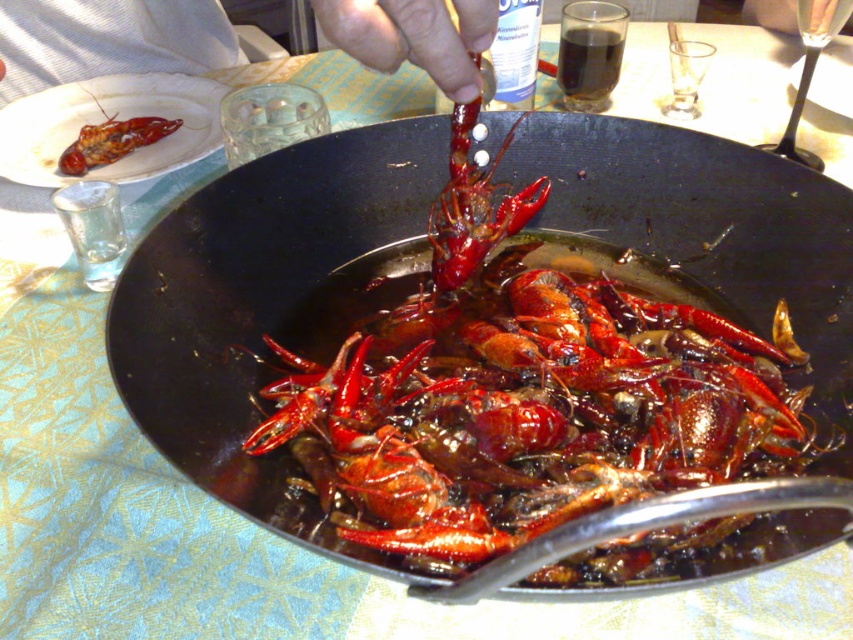
You are a food stylist arranging a photo shoot. You have a matte black plate at upper left and a matte red lobster at upper left. Which object should you move to the right to make space for a new ingredient?

The matte black plate at upper left is positioned on the left side of the matte red lobster at upper left. To make space for a new ingredient, move the matte black plate at upper left to the right side of the matte red lobster at upper left.

You are setting up a dining table and need to place the black matte wok at center and the matte black plate at upper left. If the wok is wider than the plate, will it fit on the table without overlapping the plate?

The black matte wok at center might be wider than the matte black plate at upper left, so there is a possibility that it could overlap the plate if placed carelessly. Ensure proper spacing between them to avoid overlapping.

You are sitting at the dining table and want to reach for an item between the two points labeled point (207, 97) and point (77, 145). Which point is closer to you?

Point (207, 97) is closer to you because it is further to the viewer than point (77, 145).